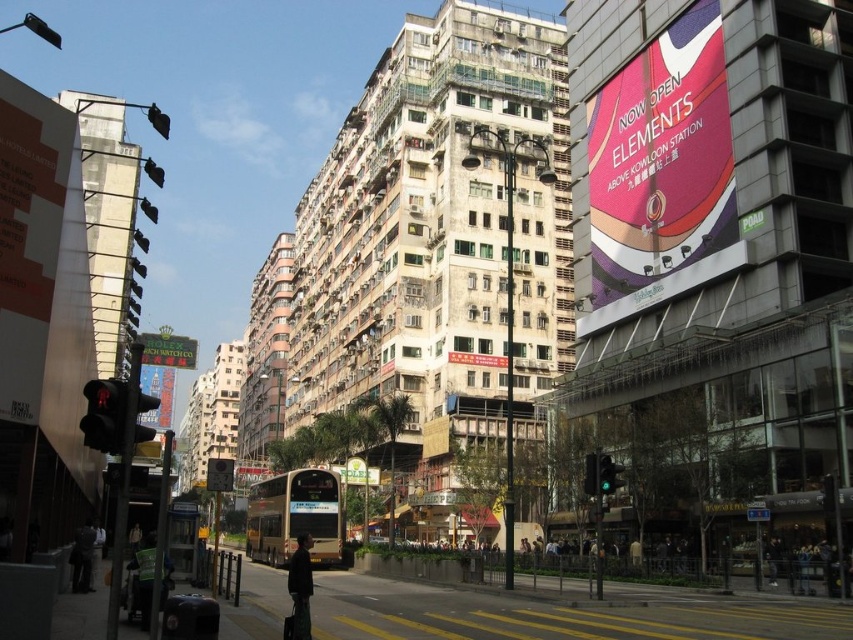
You are a photographer standing on the sidewalk and want to capture both the metallic gold rolex sign at left and the green glass traffic light at center in your shot. Which object will appear bigger in your photo?

The metallic gold rolex sign at left will appear bigger in the photo because it is larger in size than the green glass traffic light at center.

You are a photographer standing on the sidewalk and want to capture both the matte black traffic light at left and the metallic silver sign at center in your shot. Which object will appear narrower in the photo?

The matte black traffic light at left is thinner than the metallic silver sign at center, so it will appear narrower in the photo.